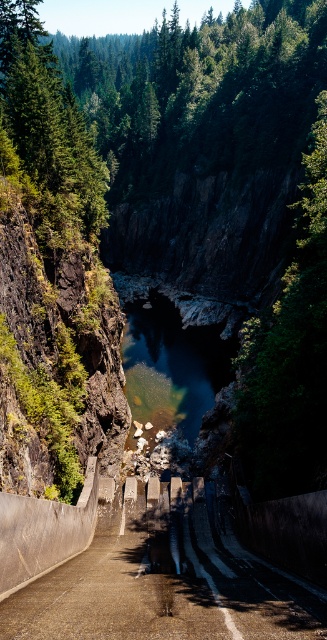
You are standing at the edge of the canyon and notice the concrete steps at center and the clear blue water at center. Which one is lower in elevation?

The concrete steps at center has a lesser height compared to clear blue water at center, so the concrete steps at center is lower in elevation.

You are standing at the entrance of the canyon and want to reach the river. There are concrete steps at center located at point (166, 580). Can you use these steps to safely descend to the river?

The concrete steps at center located at point (166, 580) provide a safe path to descend to the river, so yes, you can use them to safely reach the river.